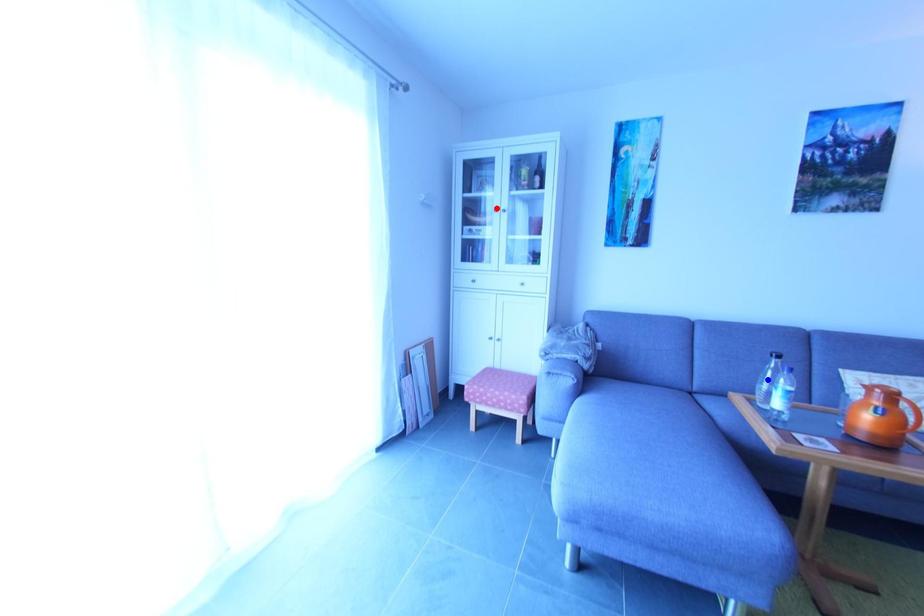
Question: Two points are marked on the image. Which point is closer to the camera?

Choices:
 (A) Blue point is closer.
 (B) Red point is closer.

Answer: (A)